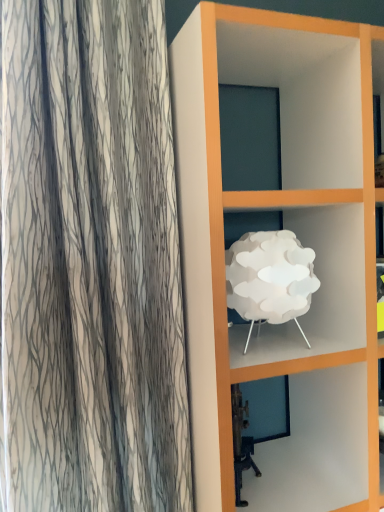
Question: Should I look upward or downward to see white paper-like at center?

Choices:
 (A) up
 (B) down

Answer: (B)